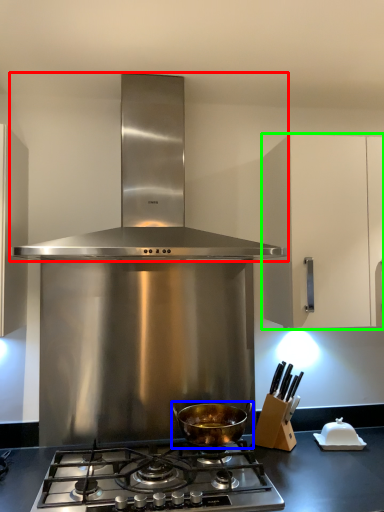
Question: Estimate the real-world distances between objects in this image. Which object is farther from kitchen appliance (highlighted by a red box), kitchen appliance (highlighted by a blue box) or cabinetry (highlighted by a green box)?

Choices:
 (A) kitchen appliance
 (B) cabinetry

Answer: (A)